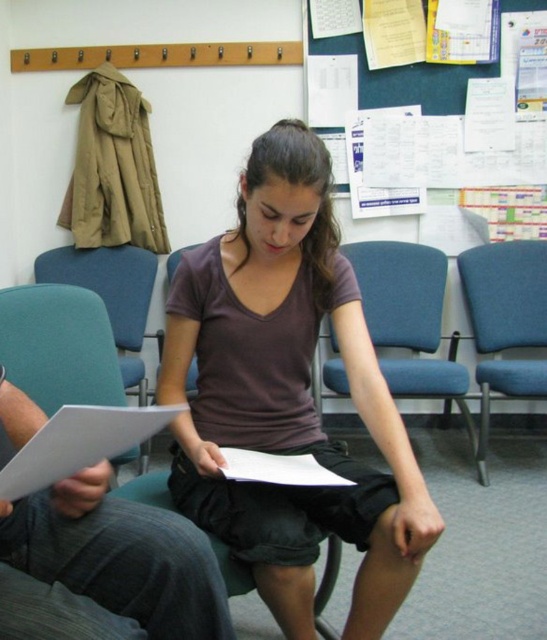
You are standing in the room and want to move from the blue fabric bulletin board at upper center to the blue fabric chair at right. Which direction should you move in?

You should move to the right to go from the blue fabric bulletin board at upper center to the blue fabric chair at right since the blue fabric chair at right is located to the right of the blue fabric bulletin board at upper center.

You are organizing a small event in the room and need to place a 2.5 feet wide table between the blue fabric chair at right and the blue fabric bulletin board at upper center. Can the table fit horizontally between them?

The blue fabric chair at right is narrower than the blue fabric bulletin board at upper center, so the 2.5 feet wide table can fit horizontally between them since the space between them is wider than the table.

You are standing in the classroom and want to reach the point at coordinates point (509,330). If your walking speed is 1.2 meters per second, how many seconds will it take to reach that point?

The distance of point (509,330) from camera is 2.79 meters. At a speed of 1.2 meters per second, it would take approximately 2.79 divided by 1.2 equals 2.325 seconds, so about 2.3 seconds.